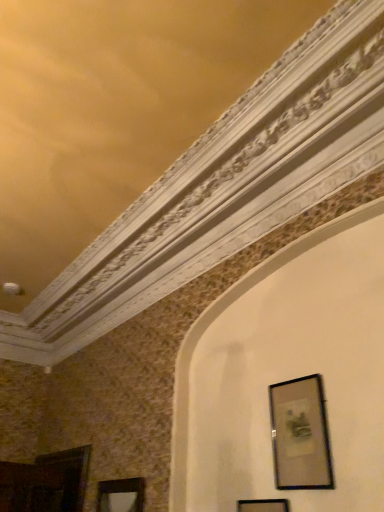
The height and width of the screenshot is (512, 384). Describe the element at coordinates (300, 435) in the screenshot. I see `matte black picture frame at lower right, the third picture frame in the left-to-right sequence` at that location.

The width and height of the screenshot is (384, 512). What do you see at coordinates (121, 495) in the screenshot? I see `matte black picture frame at lower left, marked as the 3th picture frame in a front-to-back arrangement` at bounding box center [121, 495].

How much space does black matte picture frame at lower right, placed as the third picture frame when sorted from back to front, occupy vertically?

black matte picture frame at lower right, placed as the third picture frame when sorted from back to front, is 19.65 inches in height.

In order to click on matte black picture frame at lower right, which ranks as the second picture frame in back-to-front order in this screenshot , I will do `click(300, 435)`.

From a real-world perspective, who is located higher, matte black picture frame at lower left, the 1th picture frame when ordered from left to right, or matte black picture frame at lower right, which appears as the first picture frame when viewed from the right?

matte black picture frame at lower right, which appears as the first picture frame when viewed from the right, is physically above.

Measure the distance from matte black picture frame at lower left, arranged as the third picture frame when viewed from the right, to matte black picture frame at lower right, which ranks as the second picture frame in back-to-front order.

They are 4.04 feet apart.

Which is behind, point (140, 500) or point (282, 486)?

Positioned behind is point (140, 500).

Which is behind, matte black picture frame at lower left, marked as the 3th picture frame in a front-to-back arrangement, or matte black picture frame at lower right, which ranks as the second picture frame in front-to-back order?

Answer: matte black picture frame at lower left, marked as the 3th picture frame in a front-to-back arrangement, is further away from the camera.

Can you confirm if matte black picture frame at lower right, which ranks as the second picture frame in front-to-back order, is wider than black matte picture frame at lower right, which is counted as the 2th picture frame, starting from the left?

No, matte black picture frame at lower right, which ranks as the second picture frame in front-to-back order, is not wider than black matte picture frame at lower right, which is counted as the 2th picture frame, starting from the left.

Which object is further away from the camera, matte black picture frame at lower right, which ranks as the second picture frame in back-to-front order, or black matte picture frame at lower right, the 2th picture frame positioned from the right?

matte black picture frame at lower right, which ranks as the second picture frame in back-to-front order.

Is the surface of matte black picture frame at lower right, the third picture frame in the left-to-right sequence, in direct contact with black matte picture frame at lower right, the 2th picture frame positioned from the right?

matte black picture frame at lower right, the third picture frame in the left-to-right sequence, and black matte picture frame at lower right, the 2th picture frame positioned from the right, are clearly separated.

There is a matte black picture frame at lower right, which appears as the first picture frame when viewed from the right. Where is `the 1st picture frame below it (from a real-world perspective)`? The image size is (384, 512). the 1st picture frame below it (from a real-world perspective) is located at coordinates (121, 495).

Is matte black picture frame at lower right, which appears as the first picture frame when viewed from the right, aimed at matte black picture frame at lower left, marked as the 3th picture frame in a front-to-back arrangement?

No, matte black picture frame at lower right, which appears as the first picture frame when viewed from the right, is not turned towards matte black picture frame at lower left, marked as the 3th picture frame in a front-to-back arrangement.

Relative to matte black picture frame at lower left, the 1th picture frame when ordered from left to right, is matte black picture frame at lower right, which ranks as the second picture frame in front-to-back order, in front or behind?

matte black picture frame at lower right, which ranks as the second picture frame in front-to-back order, is in front of matte black picture frame at lower left, the 1th picture frame when ordered from left to right.

From the picture: How much distance is there between matte black picture frame at lower right, which ranks as the second picture frame in front-to-back order, and matte black picture frame at lower left, arranged as the third picture frame when viewed from the right?

A distance of 4.04 feet exists between matte black picture frame at lower right, which ranks as the second picture frame in front-to-back order, and matte black picture frame at lower left, arranged as the third picture frame when viewed from the right.

Is the surface of matte black picture frame at lower left, the 1th picture frame when ordered from left to right, in direct contact with black matte picture frame at lower right, the 2th picture frame positioned from the right?

No, matte black picture frame at lower left, the 1th picture frame when ordered from left to right, is not touching black matte picture frame at lower right, the 2th picture frame positioned from the right.

Looking at their sizes, would you say matte black picture frame at lower left, the 1th picture frame when ordered from left to right, is wider or thinner than black matte picture frame at lower right, placed as the 1th picture frame when sorted from front to back?

Clearly, matte black picture frame at lower left, the 1th picture frame when ordered from left to right, has more width compared to black matte picture frame at lower right, placed as the 1th picture frame when sorted from front to back.

Is matte black picture frame at lower left, marked as the 3th picture frame in a front-to-back arrangement, oriented away from black matte picture frame at lower right, placed as the 1th picture frame when sorted from front to back?

matte black picture frame at lower left, marked as the 3th picture frame in a front-to-back arrangement, does not have its back to black matte picture frame at lower right, placed as the 1th picture frame when sorted from front to back.

Based on their positions, is matte black picture frame at lower left, marked as the 3th picture frame in a front-to-back arrangement, located to the left or right of black matte picture frame at lower right, the 2th picture frame positioned from the right?

Clearly, matte black picture frame at lower left, marked as the 3th picture frame in a front-to-back arrangement, is on the left of black matte picture frame at lower right, the 2th picture frame positioned from the right, in the image.

Consider the image. Is black matte picture frame at lower right, which is counted as the 2th picture frame, starting from the left, bigger than matte black picture frame at lower right, the third picture frame in the left-to-right sequence?

Correct, black matte picture frame at lower right, which is counted as the 2th picture frame, starting from the left, is larger in size than matte black picture frame at lower right, the third picture frame in the left-to-right sequence.

Who is shorter, black matte picture frame at lower right, the 2th picture frame positioned from the right, or matte black picture frame at lower right, which appears as the first picture frame when viewed from the right?

matte black picture frame at lower right, which appears as the first picture frame when viewed from the right.

Considering the sizes of black matte picture frame at lower right, which is counted as the 2th picture frame, starting from the left, and matte black picture frame at lower right, the third picture frame in the left-to-right sequence, in the image, is black matte picture frame at lower right, which is counted as the 2th picture frame, starting from the left, wider or thinner than matte black picture frame at lower right, the third picture frame in the left-to-right sequence,?

Considering their sizes, black matte picture frame at lower right, which is counted as the 2th picture frame, starting from the left, looks broader than matte black picture frame at lower right, the third picture frame in the left-to-right sequence.

From a real-world perspective, is black matte picture frame at lower right, placed as the third picture frame when sorted from back to front, physically located above or below matte black picture frame at lower right, the third picture frame in the left-to-right sequence?

Clearly, from a real-world perspective, black matte picture frame at lower right, placed as the third picture frame when sorted from back to front, is below matte black picture frame at lower right, the third picture frame in the left-to-right sequence.

Find the location of `picture frame that is the 1st object above the black matte picture frame at lower right, placed as the 1th picture frame when sorted from front to back (from a real-world perspective)`. picture frame that is the 1st object above the black matte picture frame at lower right, placed as the 1th picture frame when sorted from front to back (from a real-world perspective) is located at coordinates (121, 495).

Considering the relative positions of black matte picture frame at lower right, placed as the 1th picture frame when sorted from front to back, and matte black picture frame at lower left, marked as the 3th picture frame in a front-to-back arrangement, in the image provided, is black matte picture frame at lower right, placed as the 1th picture frame when sorted from front to back, to the right of matte black picture frame at lower left, marked as the 3th picture frame in a front-to-back arrangement, from the viewer's perspective?

Yes.

Does black matte picture frame at lower right, which is counted as the 2th picture frame, starting from the left, have a greater width compared to matte black picture frame at lower left, the 1th picture frame when ordered from left to right?

No, black matte picture frame at lower right, which is counted as the 2th picture frame, starting from the left, is not wider than matte black picture frame at lower left, the 1th picture frame when ordered from left to right.

Identify the location of the 1st picture frame in front of the matte black picture frame at lower left, the first picture frame viewed from the back, counting from the anchor's position. The width and height of the screenshot is (384, 512). (300, 435).

Where is `the 1st picture frame below the matte black picture frame at lower right, which ranks as the second picture frame in front-to-back order (from the image's perspective)`? The height and width of the screenshot is (512, 384). the 1st picture frame below the matte black picture frame at lower right, which ranks as the second picture frame in front-to-back order (from the image's perspective) is located at coordinates (263, 505).

Considering their positions, is matte black picture frame at lower right, which ranks as the second picture frame in back-to-front order, positioned further to black matte picture frame at lower right, which is counted as the 2th picture frame, starting from the left, than matte black picture frame at lower left, the first picture frame viewed from the back?

matte black picture frame at lower left, the first picture frame viewed from the back, lies further to black matte picture frame at lower right, which is counted as the 2th picture frame, starting from the left, than the other object.

When comparing their distances from black matte picture frame at lower right, the 2th picture frame positioned from the right, does matte black picture frame at lower left, marked as the 3th picture frame in a front-to-back arrangement, or matte black picture frame at lower right, which ranks as the second picture frame in front-to-back order, seem further?

Among the two, matte black picture frame at lower left, marked as the 3th picture frame in a front-to-back arrangement, is located further to black matte picture frame at lower right, the 2th picture frame positioned from the right.

Estimate the real-world distances between objects in this image. Which object is closer to matte black picture frame at lower left, marked as the 3th picture frame in a front-to-back arrangement, matte black picture frame at lower right, which appears as the first picture frame when viewed from the right, or black matte picture frame at lower right, the 2th picture frame positioned from the right?

black matte picture frame at lower right, the 2th picture frame positioned from the right, is closer to matte black picture frame at lower left, marked as the 3th picture frame in a front-to-back arrangement.

Considering their positions, is black matte picture frame at lower right, which is counted as the 2th picture frame, starting from the left, positioned further to matte black picture frame at lower left, marked as the 3th picture frame in a front-to-back arrangement, than matte black picture frame at lower right, which ranks as the second picture frame in back-to-front order?

matte black picture frame at lower right, which ranks as the second picture frame in back-to-front order.

Considering their positions, is black matte picture frame at lower right, placed as the 1th picture frame when sorted from front to back, positioned further to matte black picture frame at lower right, the third picture frame in the left-to-right sequence, than matte black picture frame at lower left, arranged as the third picture frame when viewed from the right?

matte black picture frame at lower left, arranged as the third picture frame when viewed from the right, is positioned further to the anchor matte black picture frame at lower right, the third picture frame in the left-to-right sequence.

Considering their positions, is matte black picture frame at lower left, marked as the 3th picture frame in a front-to-back arrangement, positioned further to matte black picture frame at lower right, which ranks as the second picture frame in front-to-back order, than black matte picture frame at lower right, which is counted as the 2th picture frame, starting from the left?

matte black picture frame at lower left, marked as the 3th picture frame in a front-to-back arrangement, lies further to matte black picture frame at lower right, which ranks as the second picture frame in front-to-back order, than the other object.

You are a GUI agent. You are given a task and a screenshot of the screen. Output one action in this format:
    pyautogui.click(x=<x>, y=<y>)
    Task: Click on the picture frame situated between matte black picture frame at lower left, arranged as the third picture frame when viewed from the right, and matte black picture frame at lower right, the third picture frame in the left-to-right sequence, from left to right
    
    Given the screenshot: What is the action you would take?
    pyautogui.click(x=263, y=505)